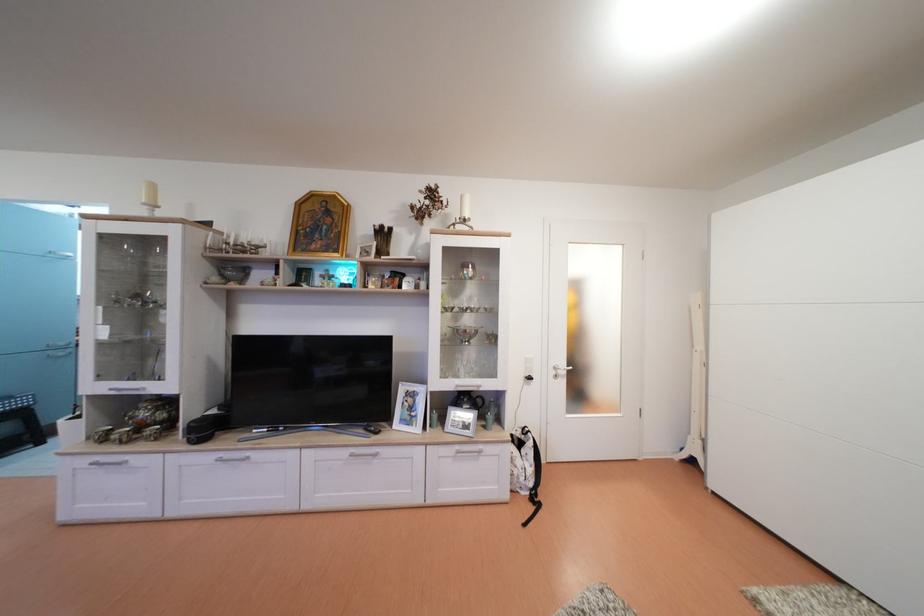
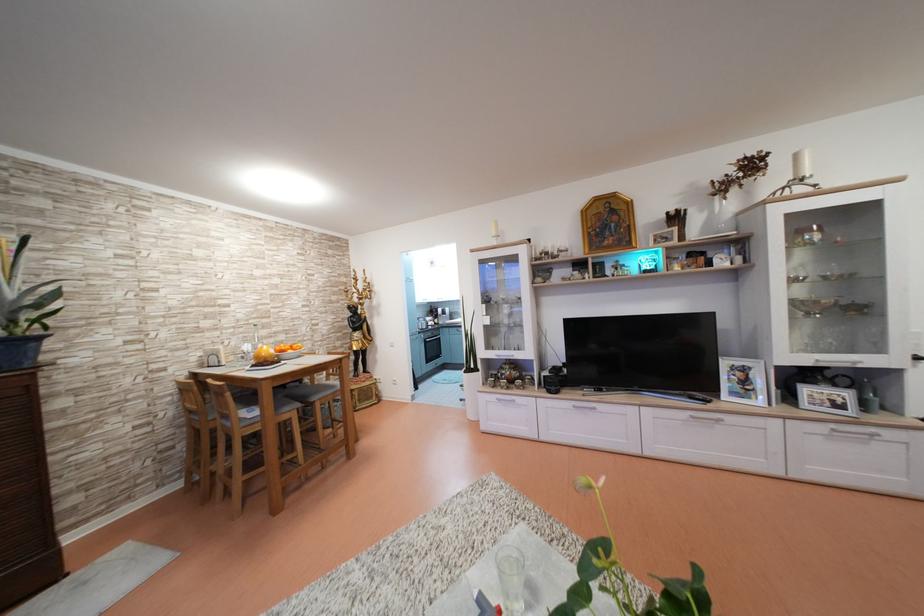
Find the pixel in the second image that matches [465,453] in the first image.

(840, 431)